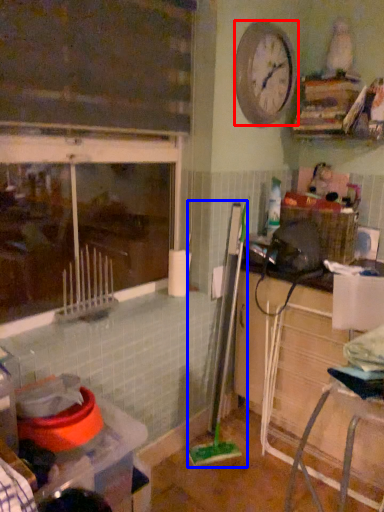
Question: Which point is closer to the camera, clock (highlighted by a red box) or brush (highlighted by a blue box)?

Choices:
 (A) clock
 (B) brush

Answer: (A)